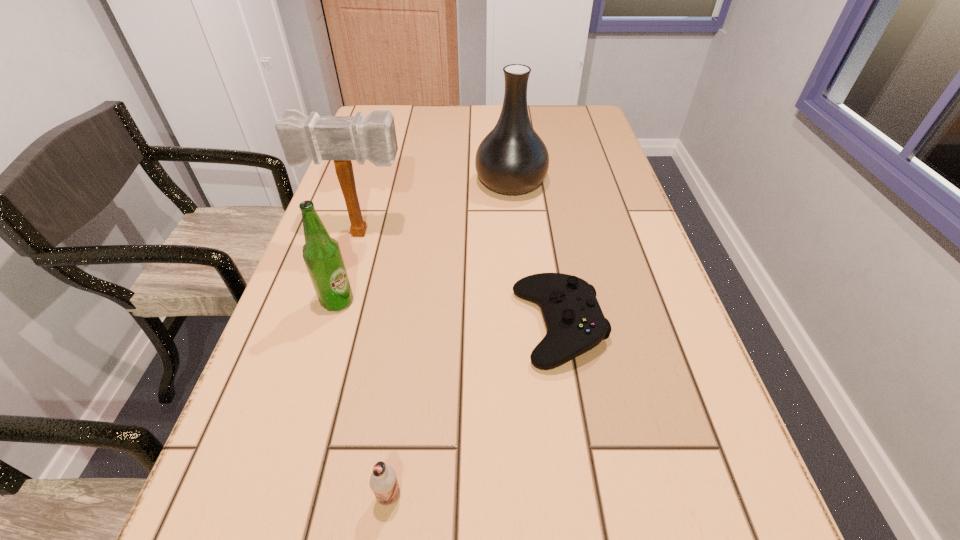
This screenshot has height=540, width=960. I want to click on unoccupied position between the fourth tallest object and the second farthest object, so click(x=375, y=364).

The width and height of the screenshot is (960, 540). I want to click on vacant area that lies between the mallet and the fourth tallest object, so click(x=375, y=364).

The height and width of the screenshot is (540, 960). In order to click on vacant space that is in between the chocolate milk and the mallet in this screenshot , I will do `click(375, 364)`.

The image size is (960, 540). In order to click on vacant space that's between the third tallest object and the vase in this screenshot , I will do `click(424, 242)`.

I want to click on free spot between the fourth nearest object and the control, so click(461, 280).

Where is `vacant area between the second shortest object and the farthest object`? The image size is (960, 540). vacant area between the second shortest object and the farthest object is located at coordinates (450, 340).

Locate an element on the screen. free space between the beer bottle and the chocolate milk is located at coordinates (364, 399).

The height and width of the screenshot is (540, 960). In order to click on free space between the farthest object and the second farthest object in this screenshot , I will do `click(436, 208)`.

Select which object appears as the closest to the control. Please provide its 2D coordinates. Your answer should be formatted as a tuple, i.e. [(x, y)], where the tuple contains the x and y coordinates of a point satisfying the conditions above.

[(383, 482)]

Locate an element on the screen. the second closest object to the beer bottle is located at coordinates (575, 323).